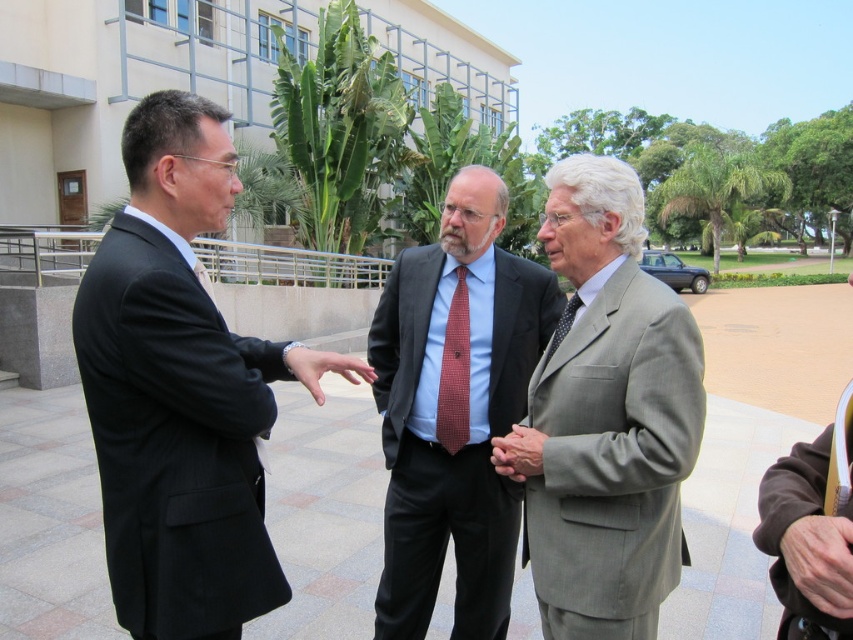
Question: Based on their relative distances, which object is farther from the gray wool suit at center?

Choices:
 (A) smooth skin hand at center
 (B) smooth beige hand at center

Answer: (A)

Question: Which object is positioned closest to the leather hand at center?

Choices:
 (A) gray wool suit at center
 (B) smooth beige hand at center

Answer: (A)

Question: Which point is farther to the camera?

Choices:
 (A) (219, 534)
 (B) (801, 589)

Answer: (A)

Question: Observing the image, what is the correct spatial positioning of leather hand at center in reference to smooth beige hand at center?

Choices:
 (A) above
 (B) below

Answer: (B)

Question: Is black suit at left behind smooth skin hand at center?

Choices:
 (A) yes
 (B) no

Answer: (B)

Question: Is matte black suit at center positioned in front of smooth beige hand at center?

Choices:
 (A) no
 (B) yes

Answer: (A)